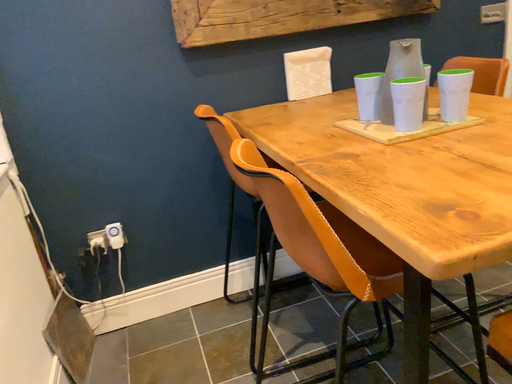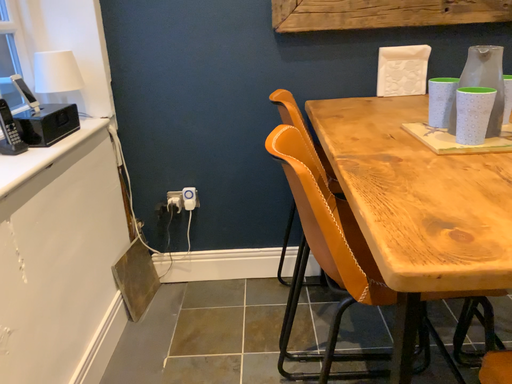
Question: Which way did the camera rotate in the video?

Choices:
 (A) rotated left
 (B) rotated right

Answer: (A)